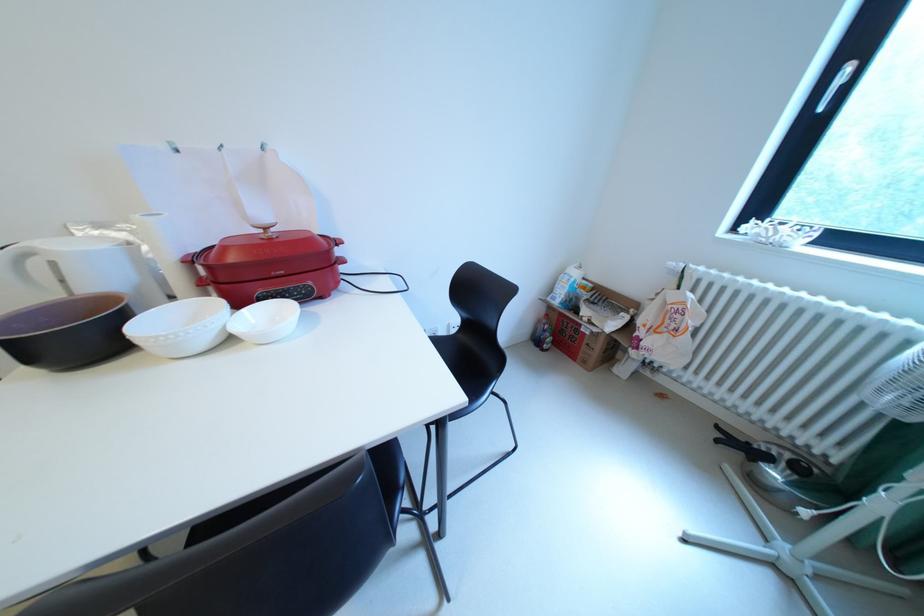
The height and width of the screenshot is (616, 924). I want to click on white kettle handle, so click(x=13, y=299).